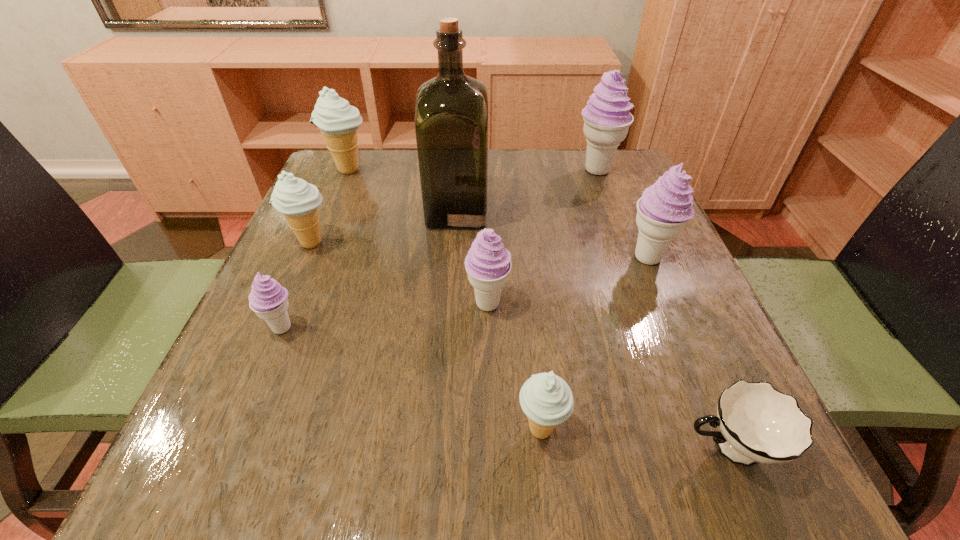
Find the location of a particular element. Image resolution: width=960 pixels, height=540 pixels. liquor is located at coordinates (451, 111).

In order to click on the biggest purple icecream in this screenshot , I will do `click(607, 118)`.

Find the location of `the farthest purple icecream`. the farthest purple icecream is located at coordinates (607, 118).

Locate an element on the screen. This screenshot has width=960, height=540. the biggest beige icecream is located at coordinates (338, 121).

I want to click on the third nearest purple icecream, so click(x=663, y=210).

Identify the location of the second biggest beige icecream. Image resolution: width=960 pixels, height=540 pixels. (296, 199).

Locate an element on the screen. The height and width of the screenshot is (540, 960). the third biggest purple icecream is located at coordinates (488, 264).

Where is `the leftmost purple icecream`? Image resolution: width=960 pixels, height=540 pixels. the leftmost purple icecream is located at coordinates (268, 299).

Identify the location of the rightmost beige icecream. This screenshot has height=540, width=960. click(546, 399).

I want to click on the smallest beige icecream, so click(546, 399).